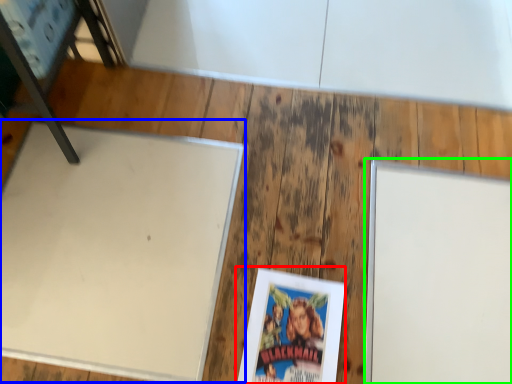
Question: Considering the real-world distances, which object is farthest from paperback book (highlighted by a red box)? table (highlighted by a blue box) or bulletin board (highlighted by a green box)?

Choices:
 (A) table
 (B) bulletin board

Answer: (A)